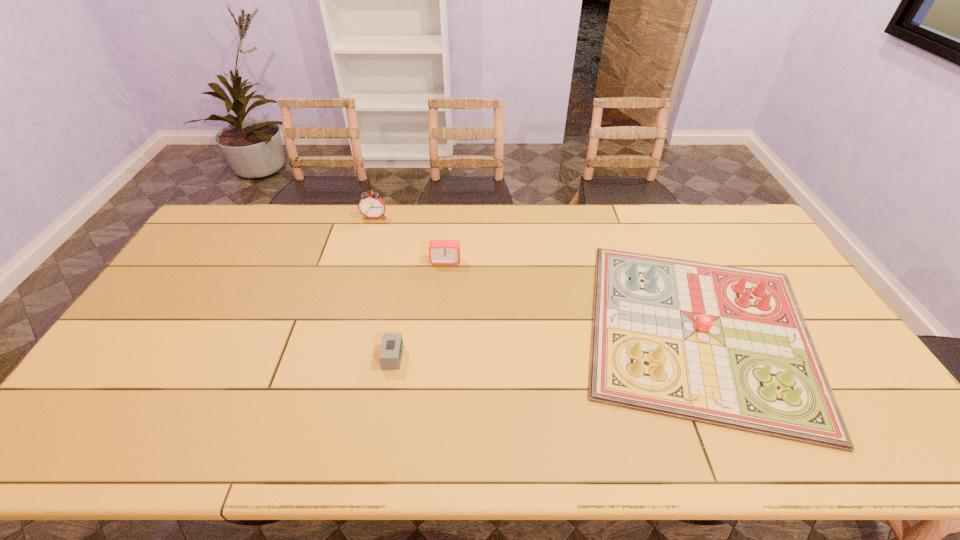
Where is `empty location between the tallest alarm clock and the third object from left to right`? The image size is (960, 540). empty location between the tallest alarm clock and the third object from left to right is located at coordinates (410, 239).

Find the location of `empty space that is in between the second shortest alarm clock and the nearest alarm clock`. empty space that is in between the second shortest alarm clock and the nearest alarm clock is located at coordinates (420, 309).

The width and height of the screenshot is (960, 540). I want to click on empty space between the tallest alarm clock and the rightmost alarm clock, so click(410, 239).

Identify which object is the nearest to the rightmost alarm clock. Please provide its 2D coordinates. Your answer should be formatted as a tuple, i.e. [(x, y)], where the tuple contains the x and y coordinates of a point satisfying the conditions above.

[(371, 205)]

The height and width of the screenshot is (540, 960). In order to click on the third closest object relative to the farthest object in this screenshot , I will do pyautogui.click(x=727, y=346).

Select which alarm clock is the closest to the tallest object. Please provide its 2D coordinates. Your answer should be formatted as a tuple, i.e. [(x, y)], where the tuple contains the x and y coordinates of a point satisfying the conditions above.

[(440, 251)]

At what (x,y) coordinates should I click in order to perform the action: click on alarm clock identified as the second closest to the leftmost alarm clock. Please return your answer as a coordinate pair (x, y). The height and width of the screenshot is (540, 960). Looking at the image, I should click on (390, 356).

The width and height of the screenshot is (960, 540). I want to click on vacant space that satisfies the following two spatial constraints: 1. on the front-facing side of the rightmost alarm clock; 2. on the right side of the rightmost object, so click(440, 330).

Where is `free space that satisfies the following two spatial constraints: 1. on the front-facing side of the rightmost alarm clock; 2. on the front-facing side of the shortest alarm clock`? The width and height of the screenshot is (960, 540). free space that satisfies the following two spatial constraints: 1. on the front-facing side of the rightmost alarm clock; 2. on the front-facing side of the shortest alarm clock is located at coordinates (438, 357).

Locate an element on the screen. The height and width of the screenshot is (540, 960). free space that satisfies the following two spatial constraints: 1. on the front-facing side of the second object from right to left; 2. on the front-facing side of the nearest alarm clock is located at coordinates (438, 357).